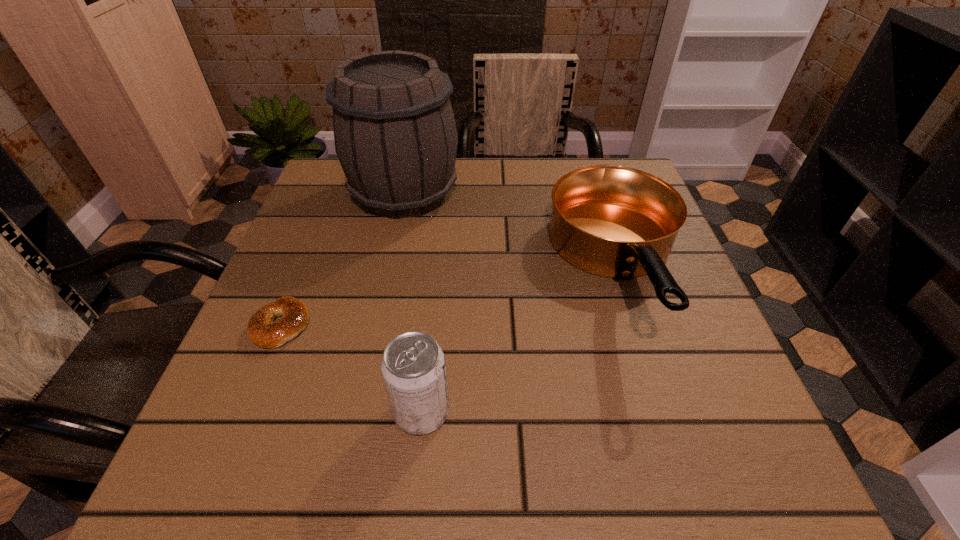
Locate an element on the screen. This screenshot has height=540, width=960. vacant space at the far left corner of the desktop is located at coordinates (344, 199).

The height and width of the screenshot is (540, 960). Identify the location of vacant area at the near left corner. (272, 458).

Locate an element on the screen. The width and height of the screenshot is (960, 540). vacant space at the far right corner is located at coordinates (575, 160).

The width and height of the screenshot is (960, 540). In the image, there is a desktop. In order to click on vacant space at the near right corner in this screenshot , I will do `click(660, 432)`.

You are a GUI agent. You are given a task and a screenshot of the screen. Output one action in this format:
    pyautogui.click(x=<x>, y=<y>)
    Task: Click on the free point between the bagel and the nearest object
    The height and width of the screenshot is (540, 960).
    Given the screenshot: What is the action you would take?
    pyautogui.click(x=351, y=368)

What are the coordinates of `vacant space that's between the nearest object and the shortest object` in the screenshot? It's located at [x=351, y=368].

Locate an element on the screen. empty space between the soda can and the wine bucket is located at coordinates (413, 302).

Locate an element on the screen. Image resolution: width=960 pixels, height=540 pixels. free space between the frying pan and the wine bucket is located at coordinates (512, 232).

Identify the location of free space between the rightmost object and the tallest object. The width and height of the screenshot is (960, 540). (512, 232).

The image size is (960, 540). I want to click on empty location between the soda can and the wine bucket, so click(413, 302).